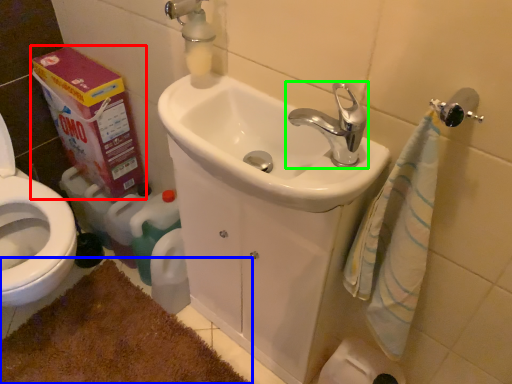
Question: Estimate the real-world distances between objects in this image. Which object is farther from carton (highlighted by a red box), bath mat (highlighted by a blue box) or tap (highlighted by a green box)?

Choices:
 (A) bath mat
 (B) tap

Answer: (B)